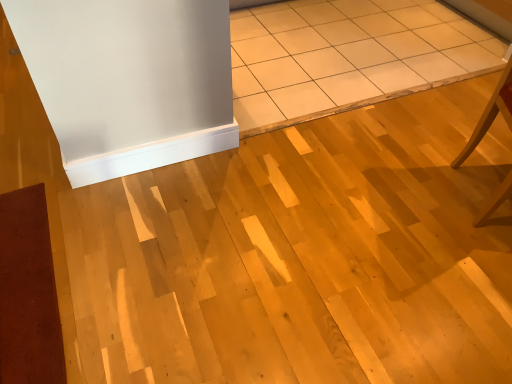
This screenshot has height=384, width=512. What do you see at coordinates (490, 113) in the screenshot?
I see `wooden chair leg at right` at bounding box center [490, 113].

The image size is (512, 384). Find the location of `wooden chair leg at right`. wooden chair leg at right is located at coordinates (490, 113).

In the scene shown: What is the approximate width of wooden chair leg at right?

wooden chair leg at right is 13.62 inches wide.

Find the location of a particular element. This screenshot has height=384, width=512. wooden chair leg at right is located at coordinates (490, 113).